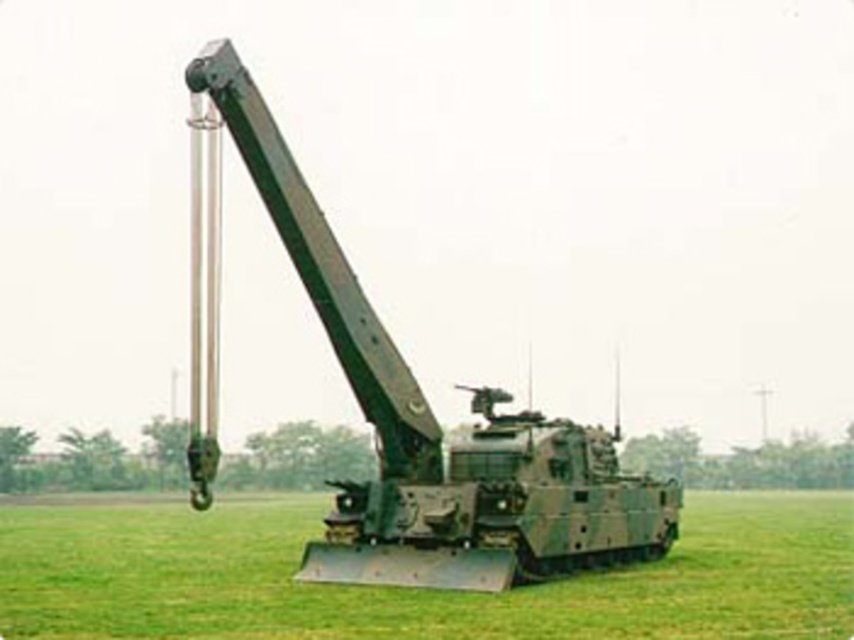
Question: Which point is closer to the camera taking this photo?

Choices:
 (A) (472, 480)
 (B) (676, 563)

Answer: (A)

Question: Which point is farther to the camera?

Choices:
 (A) green matte grass at center
 (B) camouflage metal tank at center

Answer: (B)

Question: Is green matte grass at center positioned before camouflage metal tank at center?

Choices:
 (A) yes
 (B) no

Answer: (A)

Question: Can you confirm if green matte grass at center is bigger than camouflage metal tank at center?

Choices:
 (A) yes
 (B) no

Answer: (B)

Question: Is green matte grass at center bigger than camouflage metal tank at center?

Choices:
 (A) no
 (B) yes

Answer: (A)